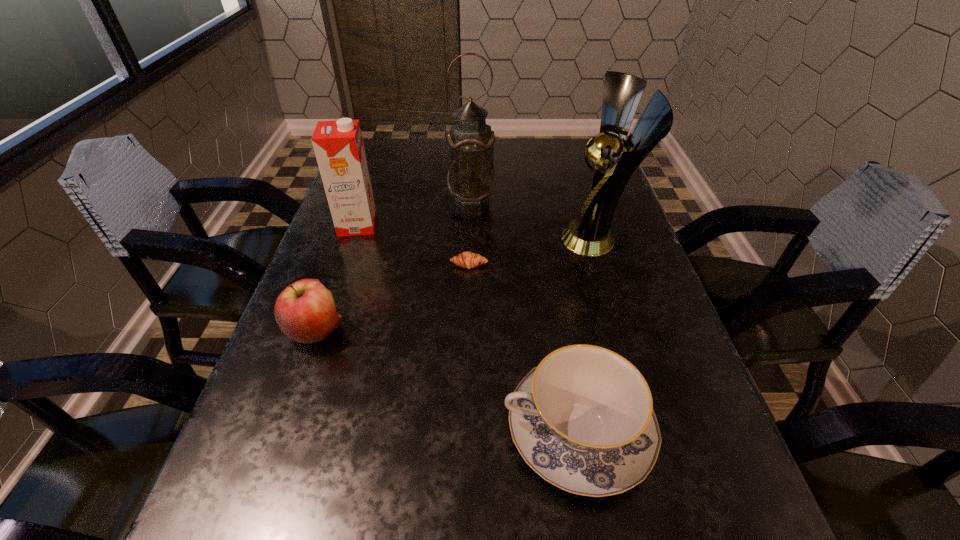
Image resolution: width=960 pixels, height=540 pixels. In order to click on oil lamp in this screenshot , I will do `click(471, 175)`.

Identify the location of award. (616, 160).

The width and height of the screenshot is (960, 540). I want to click on carton, so click(338, 145).

Locate an element on the screen. This screenshot has height=540, width=960. apple is located at coordinates (305, 311).

The height and width of the screenshot is (540, 960). Find the location of `the nearest object`. the nearest object is located at coordinates (583, 419).

You are a GUI agent. You are given a task and a screenshot of the screen. Output one action in this format:
    pyautogui.click(x=<x>, y=<y>)
    Task: Click on the shortest object
    The width and height of the screenshot is (960, 540).
    Given the screenshot: What is the action you would take?
    pyautogui.click(x=468, y=260)

Image resolution: width=960 pixels, height=540 pixels. What are the coordinates of `blank space located on the back of the oil lamp` in the screenshot? It's located at (473, 144).

Find the location of a particular element. vacant point located 0.060m at the front of the award, where the globe is visible is located at coordinates 537,239.

At what (x,y) coordinates should I click in order to perform the action: click on blank space located at the front of the award, where the globe is visible. Please return your answer as a coordinate pair (x, y). The width and height of the screenshot is (960, 540). Looking at the image, I should click on (520, 239).

Find the location of `vacant region located 0.370m at the front of the award, where the globe is visible`. vacant region located 0.370m at the front of the award, where the globe is visible is located at coordinates (408, 239).